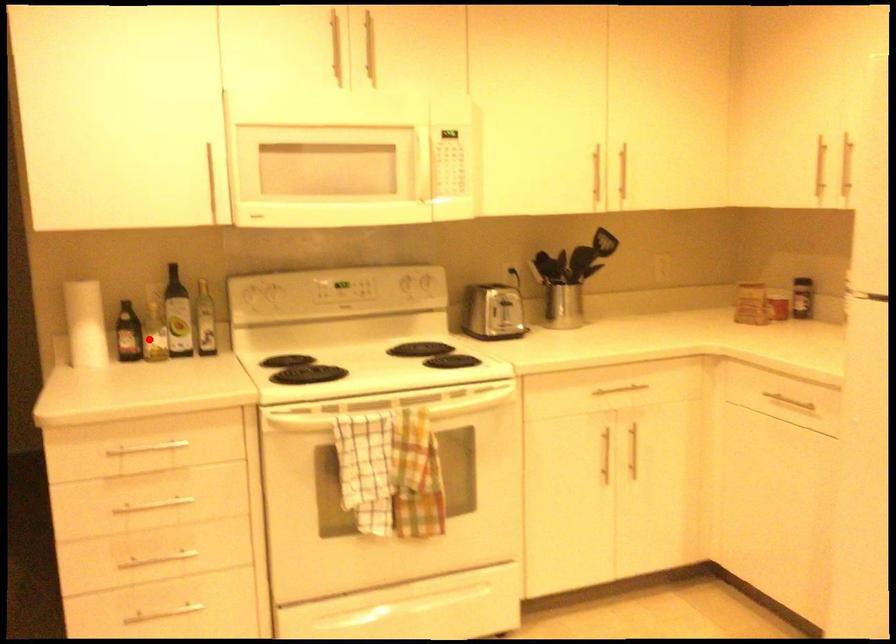
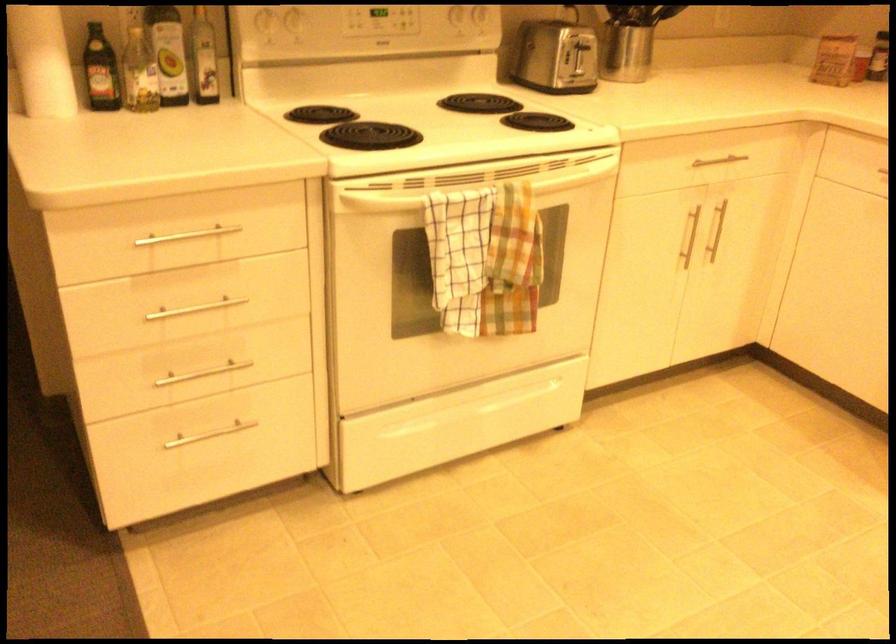
Question: A red point is marked in image1. In image2, is the corresponding 3D point closer to the camera or farther? Reply with the corresponding letter.

Choices:
 (A) The corresponding 3D point is closer.
 (B) The corresponding 3D point is farther.

Answer: (A)